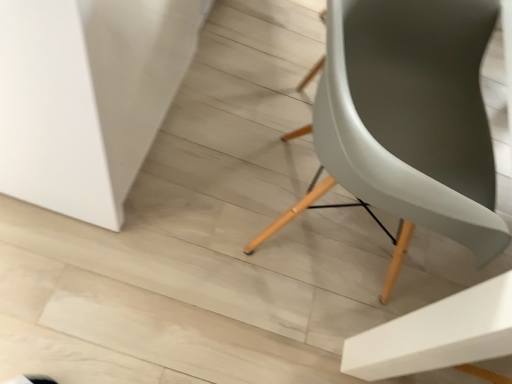
Question: From a real-world perspective, does white matte table at lower left sit lower than matte gray chair at center?

Choices:
 (A) no
 (B) yes

Answer: (B)

Question: Can you confirm if white matte table at lower left is shorter than matte gray chair at center?

Choices:
 (A) yes
 (B) no

Answer: (A)

Question: Is white matte table at lower left closer to the viewer compared to matte gray chair at center?

Choices:
 (A) no
 (B) yes

Answer: (A)

Question: Is white matte table at lower left looking in the opposite direction of matte gray chair at center?

Choices:
 (A) yes
 (B) no

Answer: (B)

Question: From the image's perspective, is white matte table at lower left beneath matte gray chair at center?

Choices:
 (A) no
 (B) yes

Answer: (A)

Question: Is white matte table at lower left aimed at matte gray chair at center?

Choices:
 (A) no
 (B) yes

Answer: (B)

Question: Can you confirm if matte gray chair at center is positioned to the left of white matte table at lower left?

Choices:
 (A) no
 (B) yes

Answer: (A)

Question: Is matte gray chair at center smaller than white matte table at lower left?

Choices:
 (A) no
 (B) yes

Answer: (B)

Question: Could white matte table at lower left be considered to be inside matte gray chair at center?

Choices:
 (A) yes
 (B) no

Answer: (B)

Question: Is matte gray chair at center positioned before white matte table at lower left?

Choices:
 (A) no
 (B) yes

Answer: (B)

Question: Is matte gray chair at center oriented away from white matte table at lower left?

Choices:
 (A) yes
 (B) no

Answer: (A)

Question: Are matte gray chair at center and white matte table at lower left making contact?

Choices:
 (A) no
 (B) yes

Answer: (A)

Question: Considering their positions, is white matte table at lower left located in front of or behind matte gray chair at center?

Choices:
 (A) front
 (B) behind

Answer: (B)